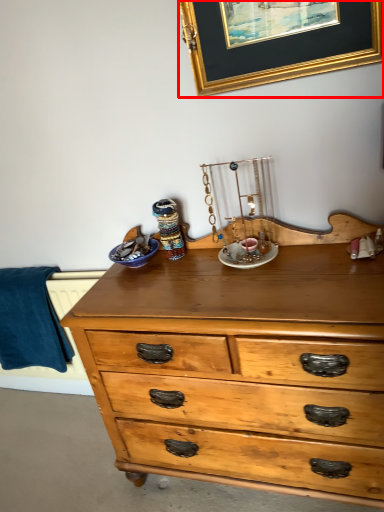
Question: From the image's perspective, where is picture frame (annotated by the red box) located relative to blanket?

Choices:
 (A) above
 (B) below

Answer: (A)